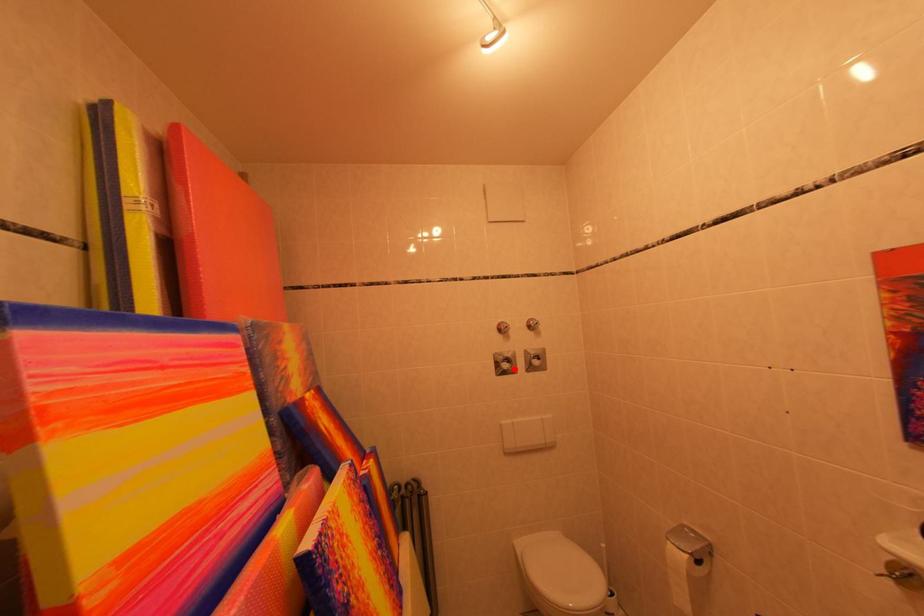
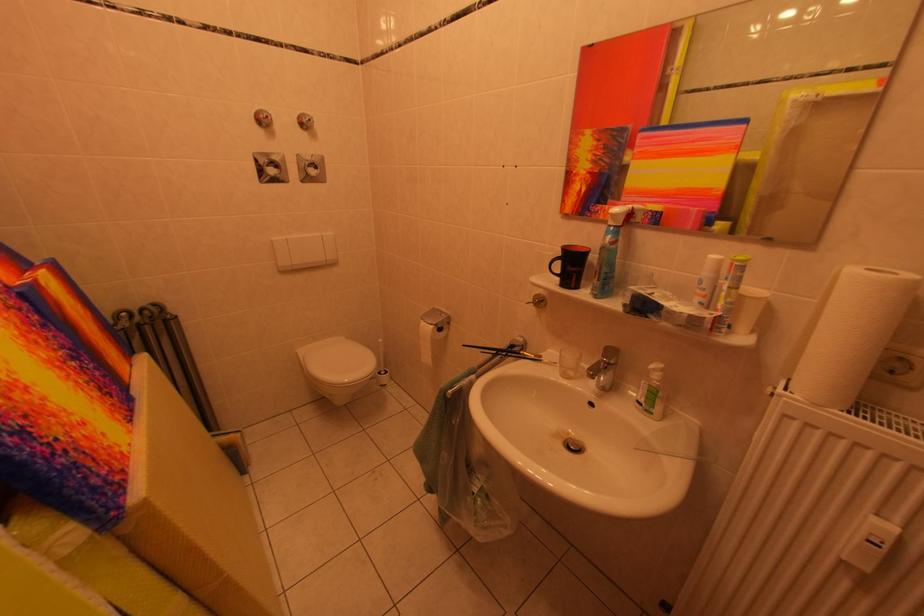
The point at the highlighted location is marked in the first image. Where is the corresponding point in the second image?

(282, 175)